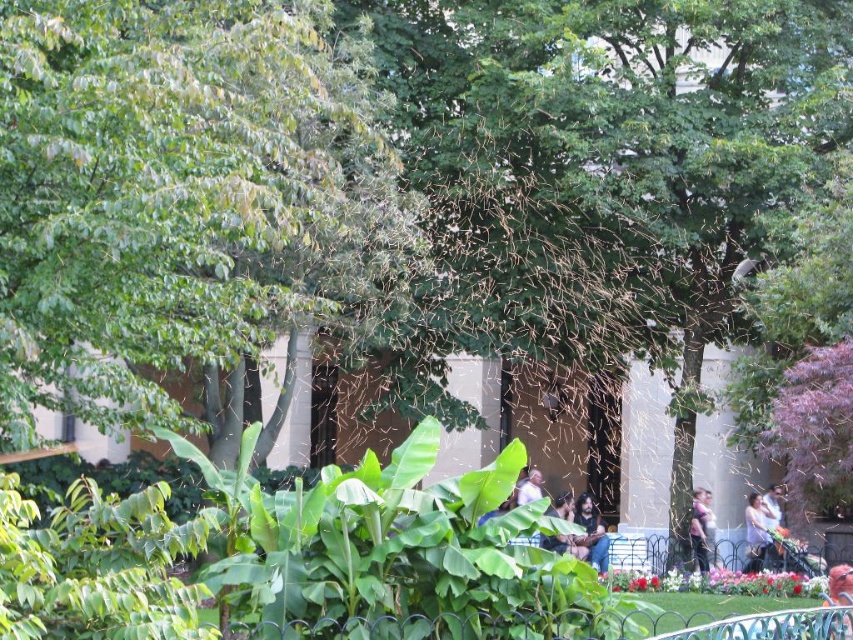
Question: Which point is closer to the camera?

Choices:
 (A) smooth skin person at lower right
 (B) matte purple shirt at center
 (C) dark brown leather jacket at center

Answer: (A)

Question: Is the position of dark brown leather jacket at center more distant than that of smooth skin person at lower right?

Choices:
 (A) yes
 (B) no

Answer: (A)

Question: Which object appears closest to the camera in this image?

Choices:
 (A) matte purple shirt at center
 (B) smooth skin person at lower right
 (C) dark brown leather jacket at center

Answer: (B)

Question: Can you confirm if smooth skin person at lower right is positioned to the right of matte purple shirt at center?

Choices:
 (A) no
 (B) yes

Answer: (B)

Question: Is dark brown leather jacket at center in front of smooth skin person at lower right?

Choices:
 (A) no
 (B) yes

Answer: (A)

Question: Which point appears closest to the camera in this image?

Choices:
 (A) (753, 520)
 (B) (703, 568)
 (C) (596, 536)

Answer: (B)